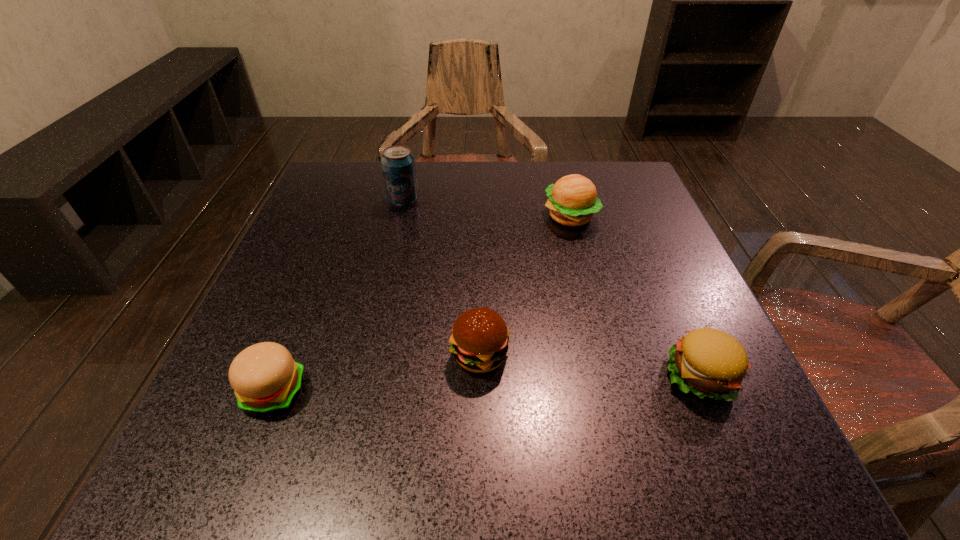
In order to click on vacant area that lies between the tallest object and the rightmost hamburger in this screenshot , I will do `click(552, 288)`.

Find the location of a particular element. The width and height of the screenshot is (960, 540). vacant area that lies between the third object from right to left and the leftmost hamburger is located at coordinates (377, 373).

What are the coordinates of `vacant space that's between the rightmost hamburger and the leftmost object` in the screenshot? It's located at (487, 383).

Identify which object is the nearest to the pop soda. Please provide its 2D coordinates. Your answer should be formatted as a tuple, i.e. [(x, y)], where the tuple contains the x and y coordinates of a point satisfying the conditions above.

[(573, 200)]

Find the location of a particular element. object that stands as the fourth closest to the leftmost object is located at coordinates click(711, 363).

At what (x,y) coordinates should I click in order to perform the action: click on hamburger that is the second nearest to the third hamburger from left to right. Please return your answer as a coordinate pair (x, y). The image size is (960, 540). Looking at the image, I should click on pyautogui.click(x=711, y=363).

Choose which hamburger is the nearest neighbor to the farthest hamburger. Please provide its 2D coordinates. Your answer should be formatted as a tuple, i.e. [(x, y)], where the tuple contains the x and y coordinates of a point satisfying the conditions above.

[(479, 342)]

Where is `vacant space that satisfies the following two spatial constraints: 1. on the back side of the second hamburger from left to right; 2. on the right side of the fourth object from left to right`? The image size is (960, 540). vacant space that satisfies the following two spatial constraints: 1. on the back side of the second hamburger from left to right; 2. on the right side of the fourth object from left to right is located at coordinates click(x=480, y=217).

Find the location of a particular element. This screenshot has height=540, width=960. free space that satisfies the following two spatial constraints: 1. on the front side of the third hamburger from right to left; 2. on the left side of the rightmost object is located at coordinates (480, 375).

Image resolution: width=960 pixels, height=540 pixels. Identify the location of vacant position in the image that satisfies the following two spatial constraints: 1. on the front side of the rightmost hamburger; 2. on the left side of the third object from left to right. tap(480, 375).